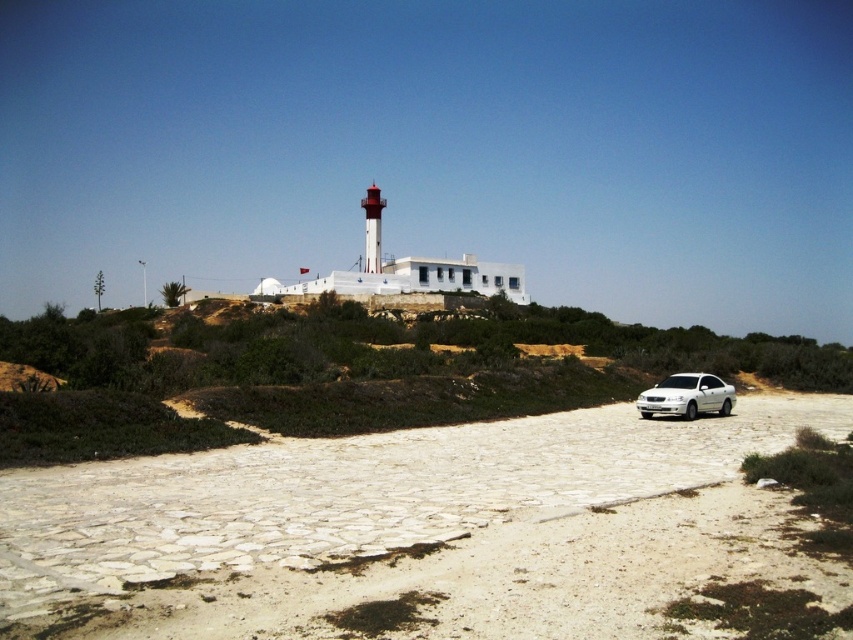
You are a delivery person who needs to drive a truck that is 2 meters tall through the road in front of the white building with a red lighthouse. The road has a low clearance sign indicating a maximum height of 2 meters. Based on the scene, can you safely drive the truck under the white stone car at center and the white metallic car at lower right without hitting the clearance limit?

The white stone car at center has a greater height than the white metallic car at lower right. Since the truck is exactly 2 meters tall and the maximum clearance is 2 meters, the truck can pass under the white metallic car at lower right but not the white stone car at center due to its greater height exceeding the clearance limit.

You are driving a car and want to park it on the white gravel road at center. Given that your car is the same size as the white metallic car at lower right, will there be enough space on the road to park your car?

The white gravel road at center is bigger than the white metallic car at lower right, so there should be enough space to park the car on the road.

You are a delivery person who needs to park your white metallic car at lower right near the white stone car at center. Given that the road is only 3 meters wide, will both cars fit side by side?

The white stone car at center is wider than the white metallic car at lower right. Since the road is 3 meters wide, it depends on the combined width of both cars. However, without knowing their exact widths, it is impossible to determine if they can fit side by side.